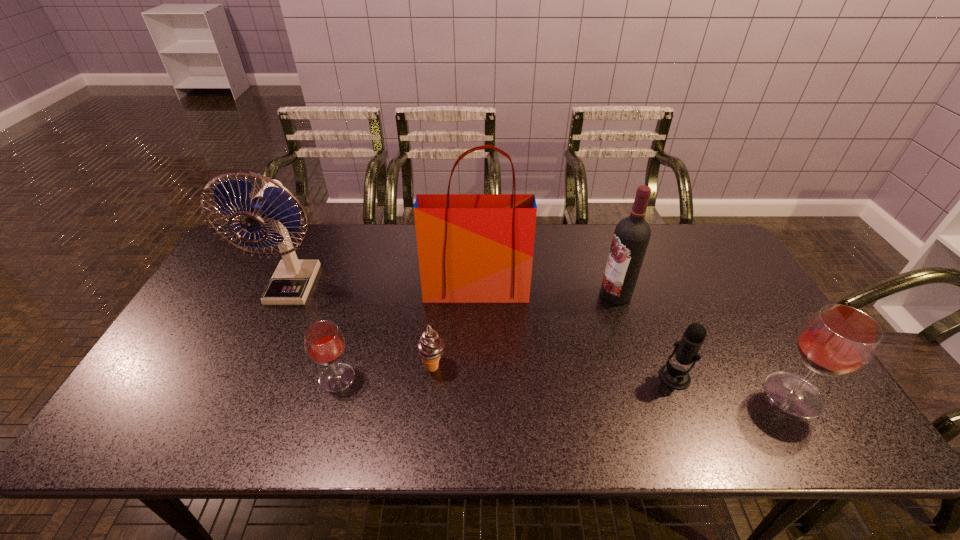
At what (x,y) coordinates should I click in order to perform the action: click on vacant region between the wine bottle and the rightmost object. Please return your answer as a coordinate pair (x, y). The width and height of the screenshot is (960, 540). Looking at the image, I should click on (705, 345).

Where is `vacant space that's between the wine bottle and the shorter wineglass`? This screenshot has height=540, width=960. vacant space that's between the wine bottle and the shorter wineglass is located at coordinates (476, 336).

Where is `vacant area between the shortest object and the shorter wineglass`? Image resolution: width=960 pixels, height=540 pixels. vacant area between the shortest object and the shorter wineglass is located at coordinates click(x=385, y=372).

The width and height of the screenshot is (960, 540). Find the location of `free spot between the left wineglass and the shortest object`. free spot between the left wineglass and the shortest object is located at coordinates (385, 372).

Find the location of `vacant space that is in between the fan and the rightmost object`. vacant space that is in between the fan and the rightmost object is located at coordinates (543, 340).

At what (x,y) coordinates should I click in order to perform the action: click on empty space that is in between the taller wineglass and the shopping bag. Please return your answer as a coordinate pair (x, y). Looking at the image, I should click on (635, 342).

Locate an element on the screen. Image resolution: width=960 pixels, height=540 pixels. empty space that is in between the shopping bag and the fan is located at coordinates (384, 287).

This screenshot has height=540, width=960. Find the location of `vacant area between the second object from left to right and the icecream`. vacant area between the second object from left to right and the icecream is located at coordinates (385, 372).

Locate an element on the screen. object that can be found as the third closest to the microphone is located at coordinates (473, 248).

Select which object is the fourth closest to the wine bottle. Please provide its 2D coordinates. Your answer should be formatted as a tuple, i.e. [(x, y)], where the tuple contains the x and y coordinates of a point satisfying the conditions above.

[(430, 347)]